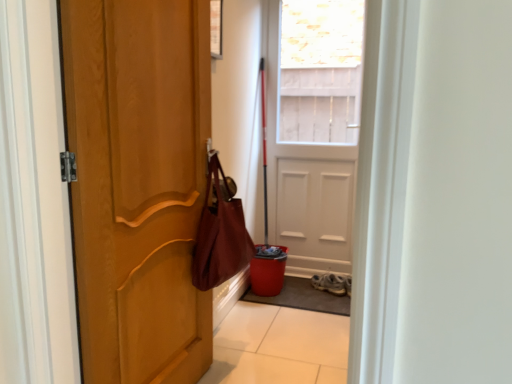
Question: Should I look upward or downward to see leather-like maroon shoulder bag at center-left?

Choices:
 (A) down
 (B) up

Answer: (A)

Question: Is gray textured mat at lower center turned away from white leather sneakers at lower center?

Choices:
 (A) no
 (B) yes

Answer: (A)

Question: Considering the relative sizes of gray textured mat at lower center and white leather sneakers at lower center in the image provided, is gray textured mat at lower center taller than white leather sneakers at lower center?

Choices:
 (A) yes
 (B) no

Answer: (B)

Question: From the image's perspective, does gray textured mat at lower center appear higher than white leather sneakers at lower center?

Choices:
 (A) no
 (B) yes

Answer: (A)

Question: Could you tell me if gray textured mat at lower center is facing white leather sneakers at lower center?

Choices:
 (A) no
 (B) yes

Answer: (A)

Question: From a real-world perspective, is gray textured mat at lower center located higher than white leather sneakers at lower center?

Choices:
 (A) yes
 (B) no

Answer: (B)

Question: Is gray textured mat at lower center further to the viewer compared to white leather sneakers at lower center?

Choices:
 (A) no
 (B) yes

Answer: (A)

Question: Can we say leather-like maroon shoulder bag at center-left lies outside white leather sneakers at lower center?

Choices:
 (A) no
 (B) yes

Answer: (B)

Question: From the image's perspective, is leather-like maroon shoulder bag at center-left on top of white leather sneakers at lower center?

Choices:
 (A) yes
 (B) no

Answer: (A)

Question: From a real-world perspective, is leather-like maroon shoulder bag at center-left located higher than white leather sneakers at lower center?

Choices:
 (A) yes
 (B) no

Answer: (A)

Question: Can you confirm if leather-like maroon shoulder bag at center-left is wider than white leather sneakers at lower center?

Choices:
 (A) no
 (B) yes

Answer: (A)

Question: Can you confirm if leather-like maroon shoulder bag at center-left is shorter than white leather sneakers at lower center?

Choices:
 (A) yes
 (B) no

Answer: (B)

Question: Does leather-like maroon shoulder bag at center-left come behind white leather sneakers at lower center?

Choices:
 (A) no
 (B) yes

Answer: (A)

Question: From a real-world perspective, is gray textured mat at lower center positioned over leather-like maroon shoulder bag at center-left based on gravity?

Choices:
 (A) yes
 (B) no

Answer: (B)